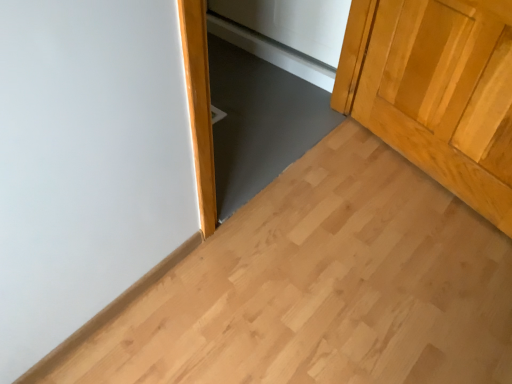
Identify the location of vacant space positioned to the left of light brown wood door at right. The width and height of the screenshot is (512, 384). (347, 177).